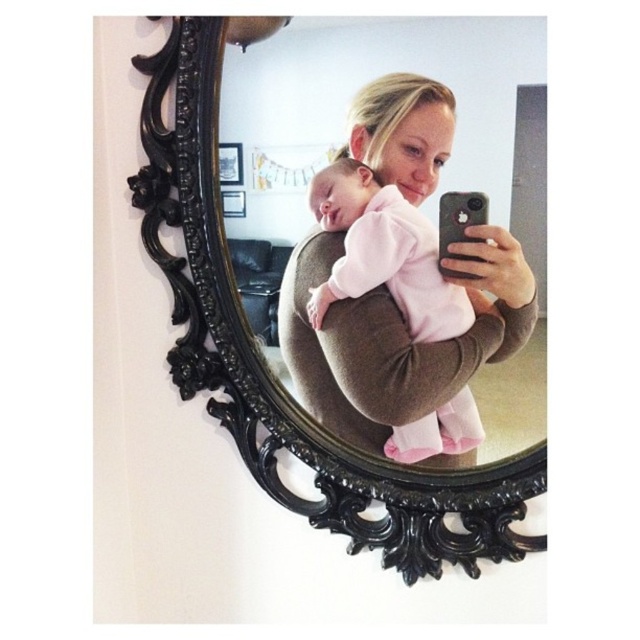
Does black ornate mirror at center have a larger size compared to pink soft fabric baby at center?

Yes, black ornate mirror at center is bigger than pink soft fabric baby at center.

Can you confirm if black ornate mirror at center is positioned above pink soft fabric baby at center?

Actually, black ornate mirror at center is below pink soft fabric baby at center.

Is point (202, 246) positioned behind point (356, 214)?

Yes, point (202, 246) is behind point (356, 214).

Find the location of a particular element. black ornate mirror at center is located at coordinates (268, 371).